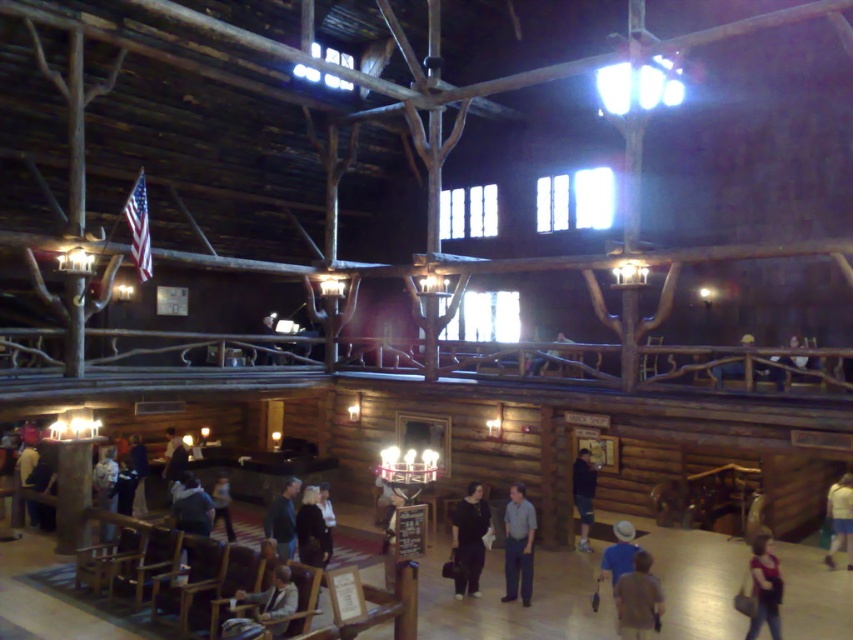
Is point (289, 576) positioned behind point (267, 531)?

No, it is not.

Where is `light brown wooden chair at lower left`? light brown wooden chair at lower left is located at coordinates (273, 600).

How far apart are light brown wooden chair at lower left and dark brown leather jacket at center?

light brown wooden chair at lower left is 16.62 feet from dark brown leather jacket at center.

Is light brown wooden chair at lower left wider than dark brown leather jacket at center?

Indeed, light brown wooden chair at lower left has a greater width compared to dark brown leather jacket at center.

Measure the distance between point (x=273, y=600) and camera.

Point (x=273, y=600) is 28.21 feet from camera.

The image size is (853, 640). I want to click on light brown wooden chair at lower left, so click(273, 600).

Between light brown wooden chair at lower left and dark blue jeans at center, which one is positioned lower?

dark blue jeans at center

Does light brown wooden chair at lower left appear on the right side of dark blue jeans at center?

No, light brown wooden chair at lower left is not to the right of dark blue jeans at center.

Does point (260, 609) lie in front of point (583, 497)?

Yes, point (260, 609) is in front of point (583, 497).

In order to click on light brown wooden chair at lower left in this screenshot , I will do `click(273, 600)`.